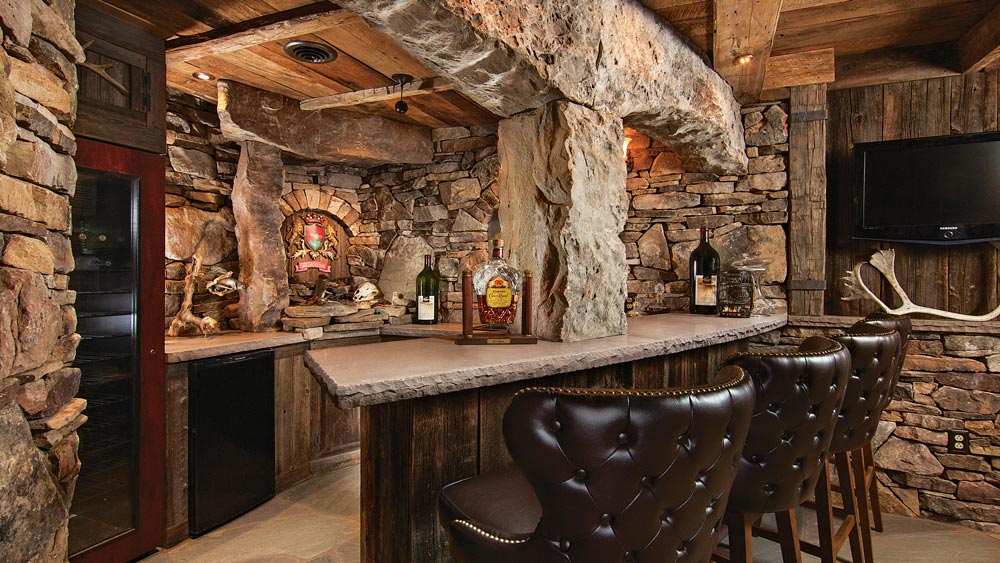
Identify the location of chair legs. The width and height of the screenshot is (1000, 563). (830, 521), (794, 531).